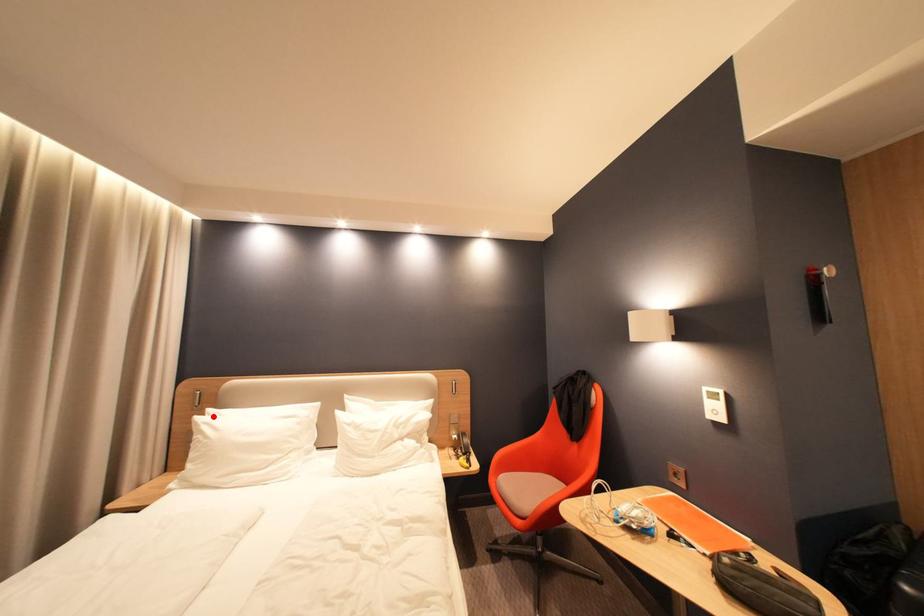
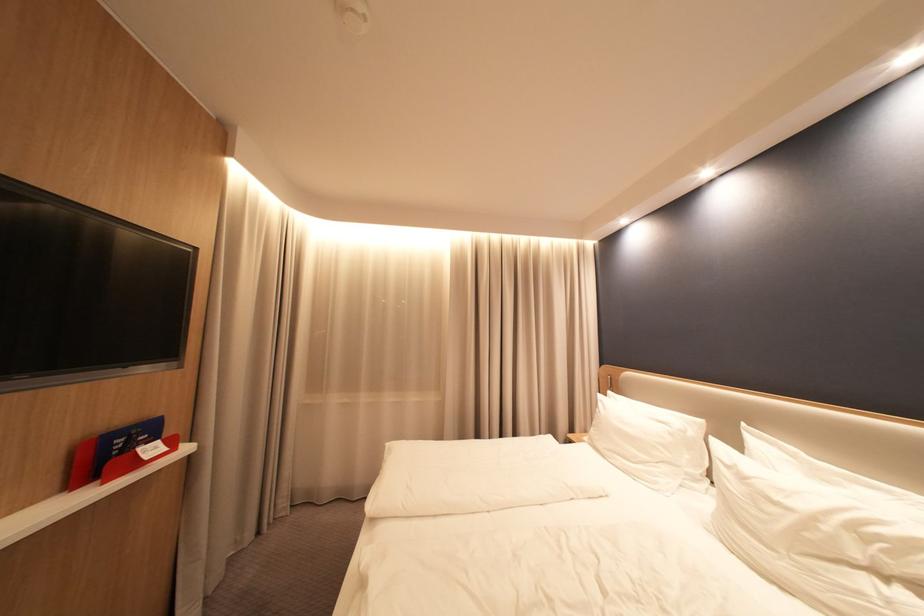
Question: I am providing you with two images of the same scene from different viewpoints. A red point is shown in image1. For the corresponding object point in image2, is it positioned nearer or farther from the camera?

Choices:
 (A) Nearer
 (B) Farther

Answer: (B)